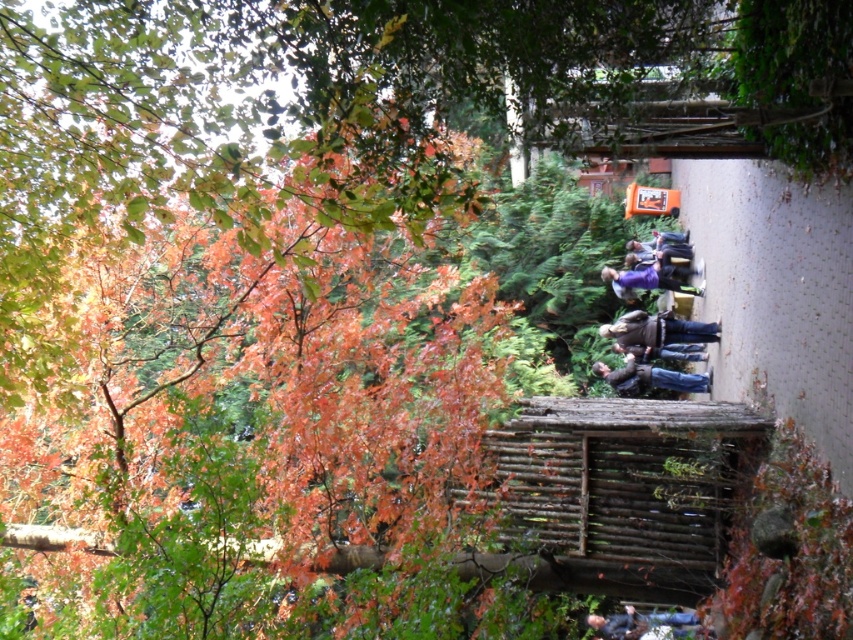
Describe the element at coordinates (660, 336) in the screenshot. I see `dark blue jeans at center` at that location.

Between dark blue jeans at center and purple fabric at center, which one has less height?

purple fabric at center is shorter.

Locate an element on the screen. This screenshot has width=853, height=640. dark blue jeans at center is located at coordinates (660, 336).

The image size is (853, 640). What are the coordinates of `dark blue jeans at center` in the screenshot? It's located at pyautogui.click(x=660, y=336).

Can you confirm if dark blue jeans at center is wider than blue jeans at center?

Yes, dark blue jeans at center is wider than blue jeans at center.

Between dark blue jeans at center and blue jeans at center, which one has more height?

dark blue jeans at center

Find the location of `dark blue jeans at center`. dark blue jeans at center is located at coordinates (660, 336).

Where is `dark blue jeans at center`? This screenshot has width=853, height=640. dark blue jeans at center is located at coordinates (660, 336).

Who is higher up, blue jeans at center or purple fabric at center?

Positioned higher is purple fabric at center.

Can you confirm if blue jeans at center is positioned above purple fabric at center?

No.

Between point (618, 384) and point (628, 278), which one is positioned behind?

The point (628, 278) is more distant.

At what (x,y) coordinates should I click in order to perform the action: click on blue jeans at center. Please return your answer as a coordinate pair (x, y). This screenshot has width=853, height=640. Looking at the image, I should click on (651, 378).